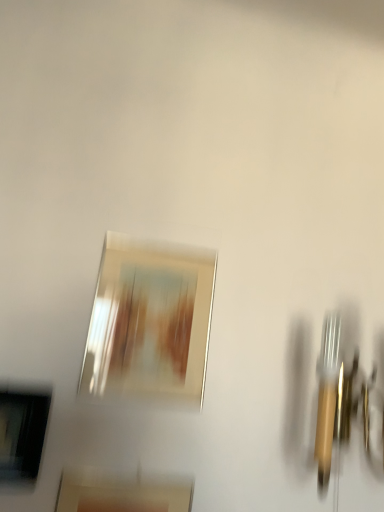
Question: Is matte gold picture frame at center, which is counted as the 3th picture frame, starting from the top, further to camera compared to matte black picture frame at lower left, the 2th picture frame positioned from the bottom?

Choices:
 (A) yes
 (B) no

Answer: (B)

Question: Is matte gold picture frame at center, positioned as the 1th picture frame in bottom-to-top order, not within matte black picture frame at lower left, the 2th picture frame positioned from the bottom?

Choices:
 (A) no
 (B) yes

Answer: (B)

Question: Does matte gold picture frame at center, positioned as the 1th picture frame in bottom-to-top order, have a lesser height compared to matte black picture frame at lower left, the 2th picture frame positioned from the bottom?

Choices:
 (A) no
 (B) yes

Answer: (A)

Question: Can matte black picture frame at lower left, marked as the second picture frame in a top-to-bottom arrangement, be found inside matte gold picture frame at center, which is counted as the 3th picture frame, starting from the top?

Choices:
 (A) no
 (B) yes

Answer: (A)

Question: From the image's perspective, is matte gold picture frame at center, positioned as the 1th picture frame in bottom-to-top order, located above matte black picture frame at lower left, marked as the second picture frame in a top-to-bottom arrangement?

Choices:
 (A) no
 (B) yes

Answer: (A)

Question: Is matte gold picture frame at center, positioned as the 1th picture frame in bottom-to-top order, oriented towards matte black picture frame at lower left, marked as the second picture frame in a top-to-bottom arrangement?

Choices:
 (A) yes
 (B) no

Answer: (B)

Question: Is matte gold picture frame at center, positioned as the 1th picture frame in bottom-to-top order, turned away from metallic silver picture frame at center, the 1th picture frame in the top-to-bottom sequence?

Choices:
 (A) yes
 (B) no

Answer: (B)

Question: Are matte gold picture frame at center, positioned as the 1th picture frame in bottom-to-top order, and metallic silver picture frame at center, the 1th picture frame in the top-to-bottom sequence, far apart?

Choices:
 (A) yes
 (B) no

Answer: (B)

Question: Could you tell me if matte gold picture frame at center, which is counted as the 3th picture frame, starting from the top, is turned towards metallic silver picture frame at center, the 1th picture frame in the top-to-bottom sequence?

Choices:
 (A) yes
 (B) no

Answer: (B)

Question: Is matte gold picture frame at center, which is counted as the 3th picture frame, starting from the top, further to the viewer compared to metallic silver picture frame at center, the 1th picture frame in the top-to-bottom sequence?

Choices:
 (A) yes
 (B) no

Answer: (B)

Question: Is matte gold picture frame at center, which is counted as the 3th picture frame, starting from the top, thinner than metallic silver picture frame at center, the 1th picture frame in the top-to-bottom sequence?

Choices:
 (A) no
 (B) yes

Answer: (A)

Question: Does matte gold picture frame at center, positioned as the 1th picture frame in bottom-to-top order, have a smaller size compared to metallic silver picture frame at center, which is counted as the 3th picture frame, starting from the bottom?

Choices:
 (A) yes
 (B) no

Answer: (B)

Question: Is matte black picture frame at lower left, marked as the second picture frame in a top-to-bottom arrangement, not inside metallic silver picture frame at center, the 1th picture frame in the top-to-bottom sequence?

Choices:
 (A) yes
 (B) no

Answer: (A)